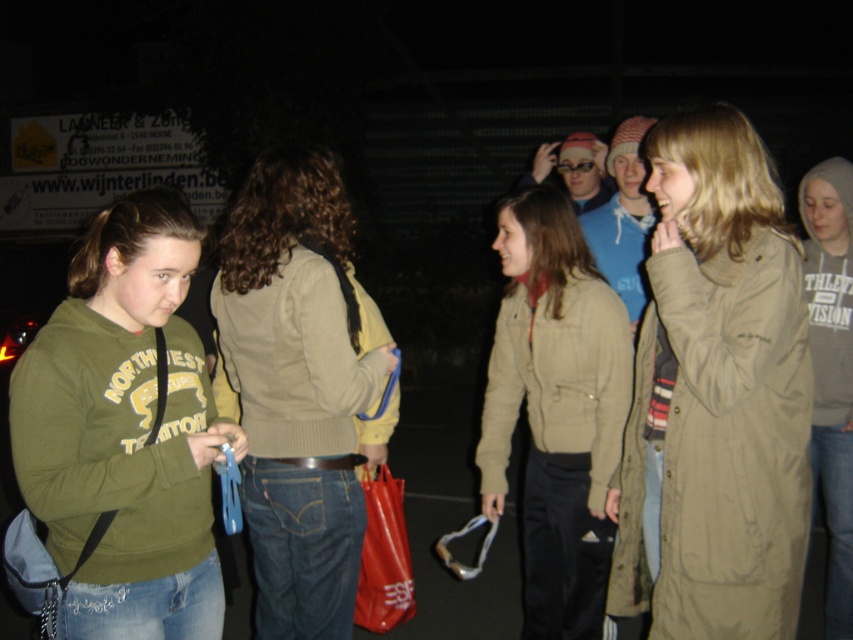
You are a photographer trying to capture a candid shot of the group. You notice the beige sweater at center and the matte khaki jacket at center. Which clothing item is positioned higher on the person wearing it?

The beige sweater at center is positioned higher on the person wearing it because it is above the matte khaki jacket at center.

You are a photographer trying to capture a candid shot of the group. You notice the matte khaki jacket at center and the beige knitted sweater at center. Which clothing item should you focus on to ensure it appears in the foreground of your photo?

The matte khaki jacket at center is below the beige knitted sweater at center, so focusing on the matte khaki jacket at center would place it in the foreground since it is lower in the frame.